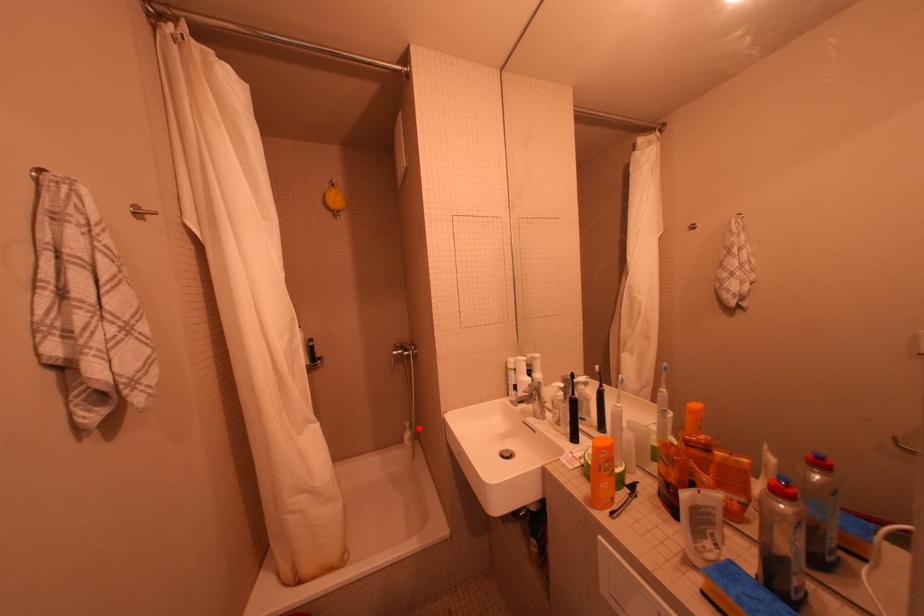
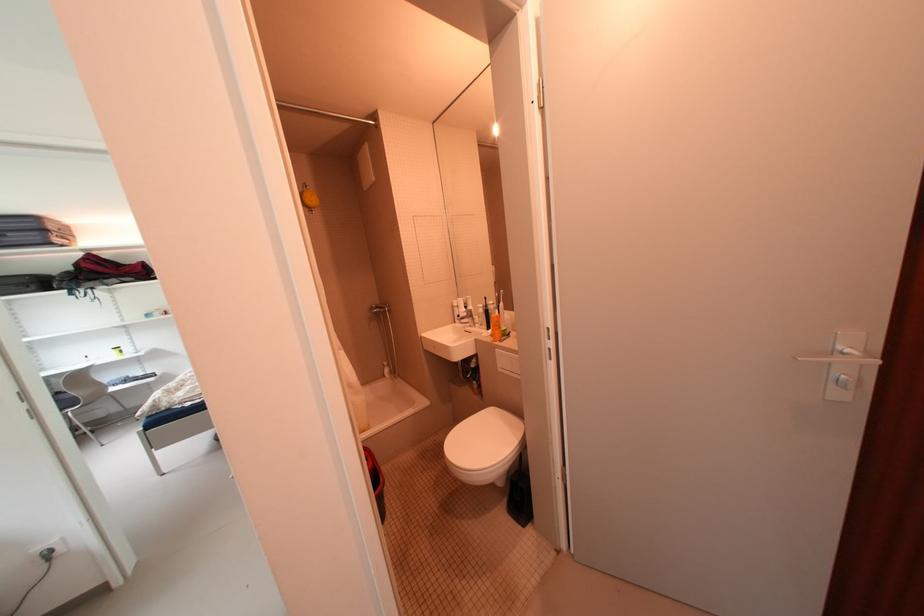
Question: I am providing you with two images of the same scene from different viewpoints. Given a red point in image1, look at the same physical point in image2. Is it:

Choices:
 (A) Closer to the viewpoint
 (B) Farther from the viewpoint

Answer: (A)